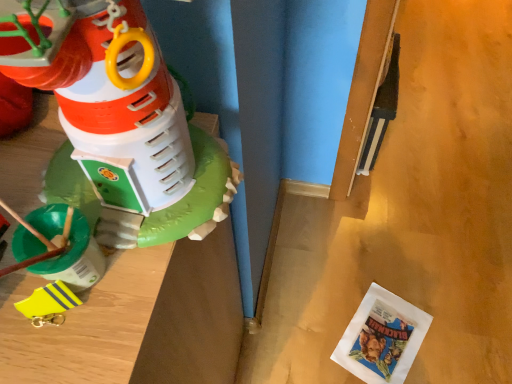
Find the location of `spots to the right of white paper comic book at lower right`. spots to the right of white paper comic book at lower right is located at coordinates (453, 330).